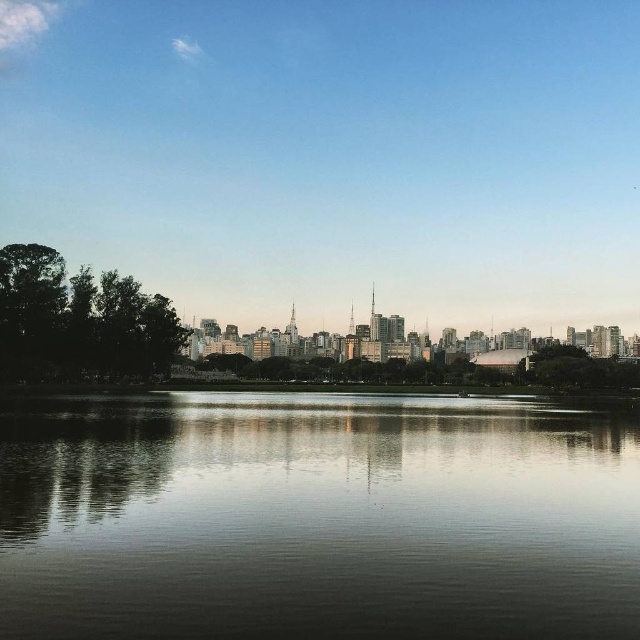
Question: Among these points, which one is farthest from the camera?

Choices:
 (A) (573, 371)
 (B) (16, 308)

Answer: (A)

Question: Which of the following is the closest to the observer?

Choices:
 (A) (131, 291)
 (B) (577, 378)

Answer: (A)

Question: Is smooth reflective water at center positioned at the back of green leafy trees at left?

Choices:
 (A) yes
 (B) no

Answer: (B)

Question: Can you confirm if green leafy trees at left is positioned below green leafy tree at right?

Choices:
 (A) no
 (B) yes

Answer: (A)

Question: Does smooth reflective water at center come behind green leafy trees at left?

Choices:
 (A) no
 (B) yes

Answer: (A)

Question: Which point is farther to the camera?

Choices:
 (A) (236, 406)
 (B) (541, 353)
 (C) (49, 353)

Answer: (B)